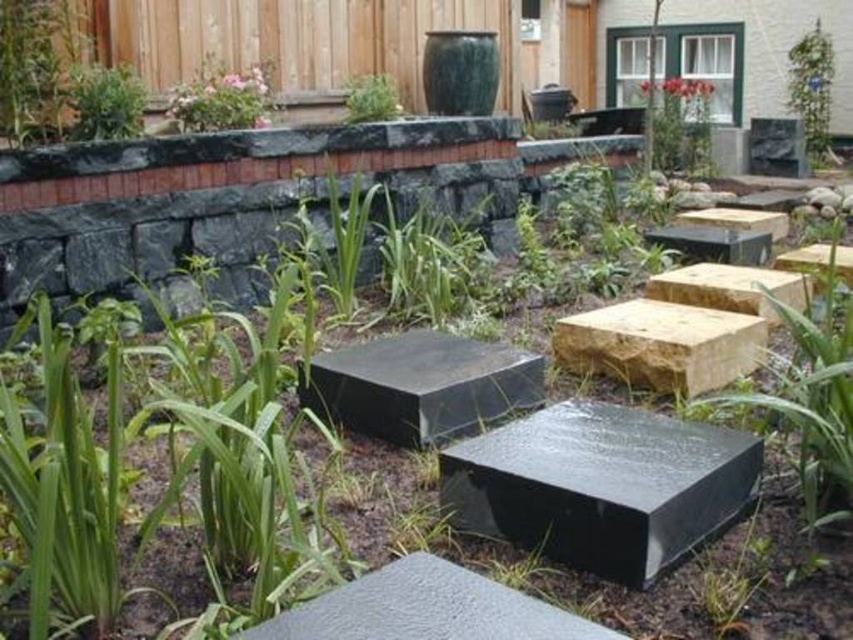
Can you confirm if green glossy plant at upper center is positioned to the right of green leafy plant at upper left?

Yes, green glossy plant at upper center is to the right of green leafy plant at upper left.

Does green glossy plant at upper center lie in front of green leafy plant at upper left?

No, green glossy plant at upper center is further to the viewer.

Who is more distant from viewer, [659,138] or [76,81]?

Point [659,138]

Find the location of a particular element. green glossy plant at upper center is located at coordinates (677, 124).

Can you confirm if green leafy plant at upper left is bigger than green glossy trellis at upper right?

Incorrect, green leafy plant at upper left is not larger than green glossy trellis at upper right.

How much distance is there between green leafy plant at upper left and green glossy trellis at upper right?

green leafy plant at upper left is 9.33 meters away from green glossy trellis at upper right.

The image size is (853, 640). What are the coordinates of `green leafy plant at upper left` in the screenshot? It's located at (103, 102).

Is green glossy plant at upper center above matte pink flowers at upper left?

Correct, green glossy plant at upper center is located above matte pink flowers at upper left.

This screenshot has width=853, height=640. Find the location of `green glossy plant at upper center`. green glossy plant at upper center is located at coordinates (677, 124).

Between point (648, 93) and point (204, 84), which one is positioned behind?

Point (648, 93)

I want to click on green glossy plant at upper center, so click(x=677, y=124).